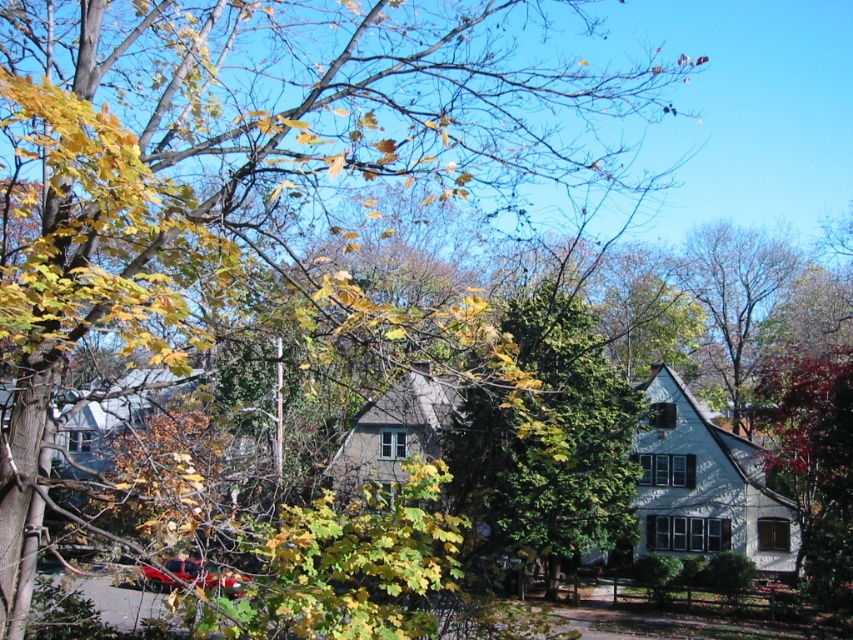
Which is above, green textured tree at center or green leafy tree at upper right?

green leafy tree at upper right is above.

Between point (550, 502) and point (758, 285), which one is positioned behind?

The point (758, 285) is more distant.

Locate an element on the screen. This screenshot has width=853, height=640. green textured tree at center is located at coordinates (544, 442).